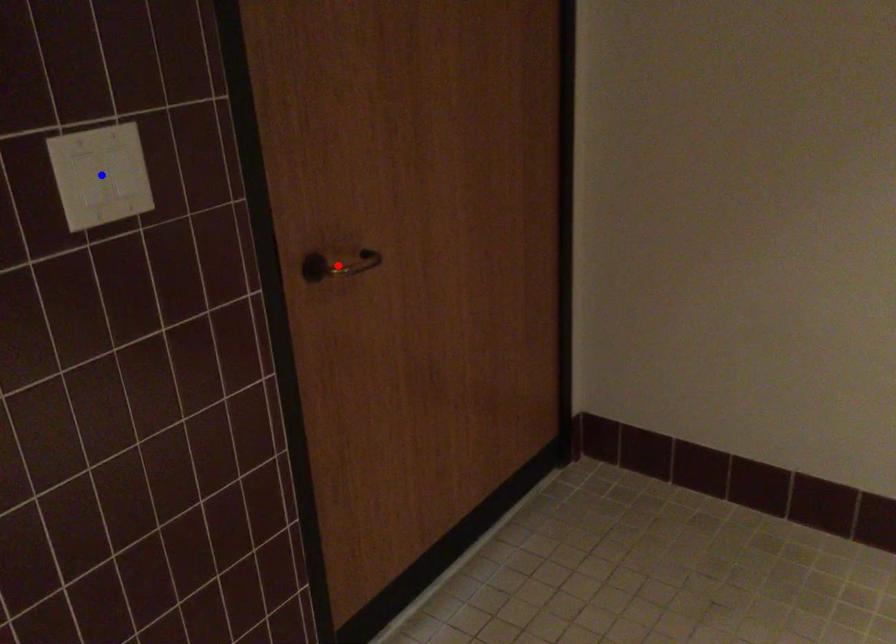
Question: Which of the two points in the image is closer to the camera?

Choices:
 (A) Blue point is closer.
 (B) Red point is closer.

Answer: (A)